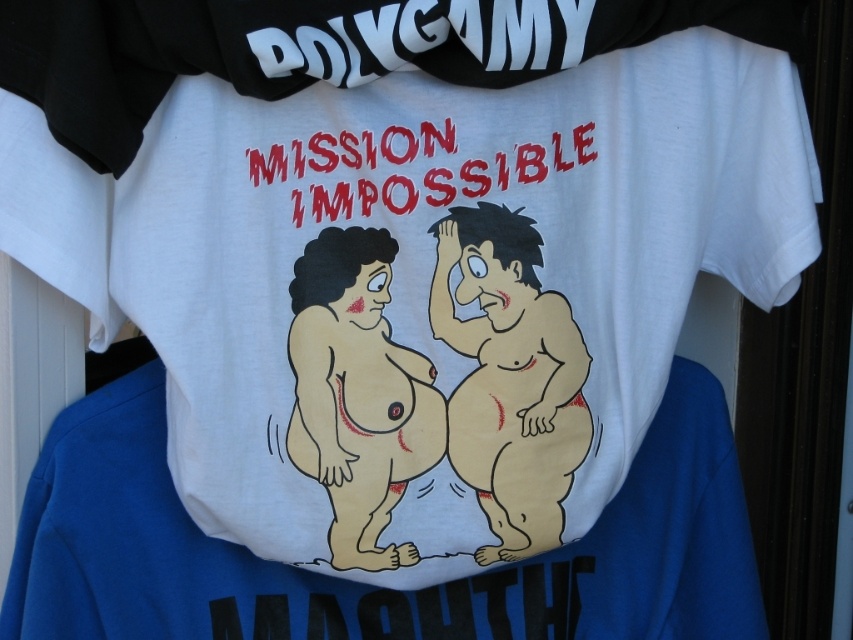
Question: Considering the relative positions of beige matte/soft cartoon man at center and brown textured body at center in the image provided, where is beige matte/soft cartoon man at center located with respect to brown textured body at center?

Choices:
 (A) above
 (B) below

Answer: (A)

Question: Among these objects, which one is farthest from the camera?

Choices:
 (A) beige matte/soft cartoon man at center
 (B) matte white t-shirt at center

Answer: (B)

Question: Where is matte white t-shirt at center located in relation to beige matte/soft cartoon man at center in the image?

Choices:
 (A) left
 (B) right

Answer: (A)

Question: Is matte white t-shirt at center smaller than brown textured body at center?

Choices:
 (A) no
 (B) yes

Answer: (A)

Question: Considering the real-world distances, which object is closest to the brown textured body at center?

Choices:
 (A) matte white t-shirt at center
 (B) beige matte/soft cartoon man at center

Answer: (B)

Question: Which of the following is the closest to the observer?

Choices:
 (A) brown textured body at center
 (B) beige matte/soft cartoon man at center

Answer: (A)